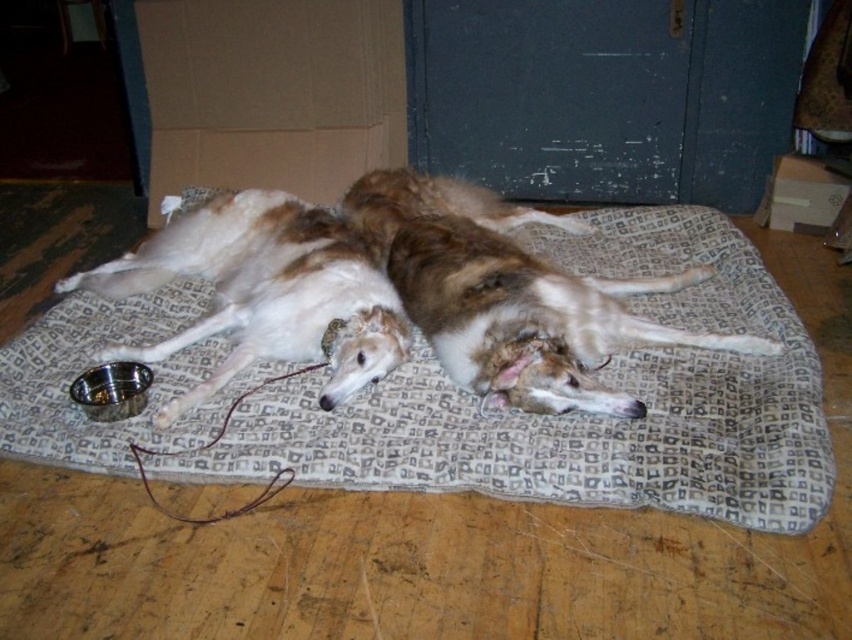
Question: Which point is farther from the camera taking this photo?

Choices:
 (A) (606, 244)
 (B) (308, 232)
 (C) (540, 342)

Answer: (A)

Question: Estimate the real-world distances between objects in this image. Which object is farther from the white fur dog at center?

Choices:
 (A) brown fur dog at center
 (B) patterned fabric dog bed at center

Answer: (A)

Question: Is white fur dog at center to the right of brown fur dog at center from the viewer's perspective?

Choices:
 (A) no
 (B) yes

Answer: (A)

Question: Does patterned fabric dog bed at center have a greater width compared to brown fur dog at center?

Choices:
 (A) yes
 (B) no

Answer: (A)

Question: Based on their relative distances, which object is nearer to the white fur dog at center?

Choices:
 (A) brown fur dog at center
 (B) patterned fabric dog bed at center

Answer: (B)

Question: Is the position of white fur dog at center more distant than that of brown fur dog at center?

Choices:
 (A) yes
 (B) no

Answer: (A)